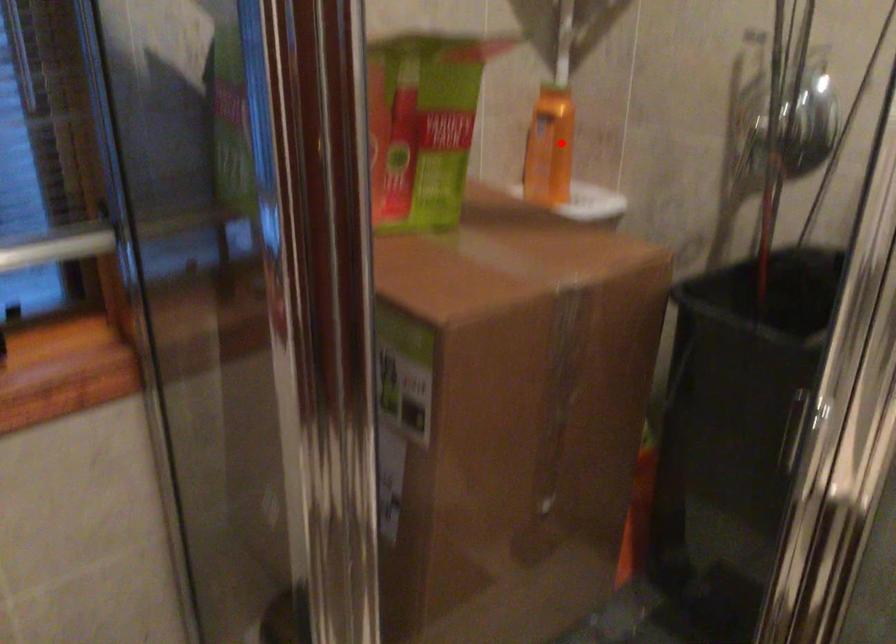
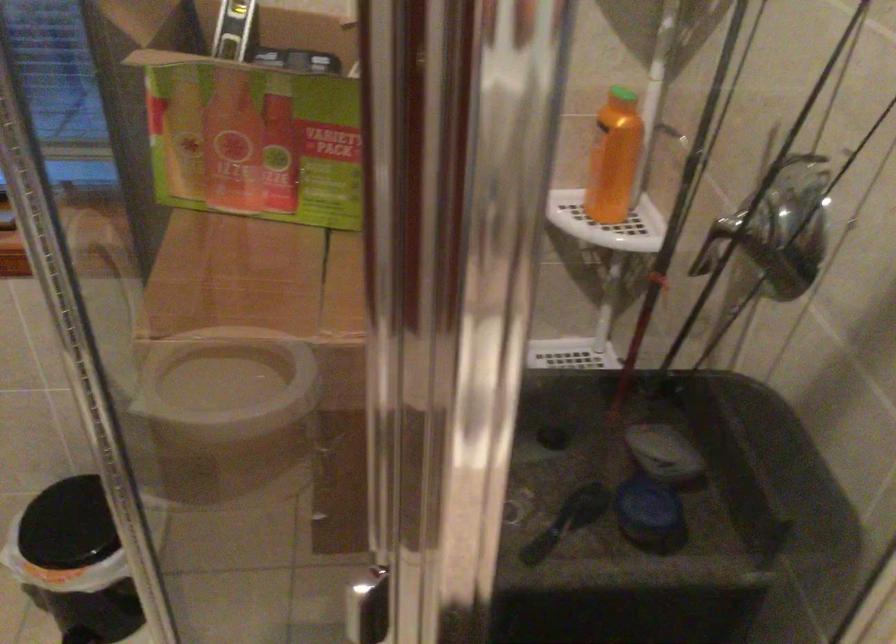
In the second image, find the point that corresponds to the highlighted location in the first image.

(614, 158)